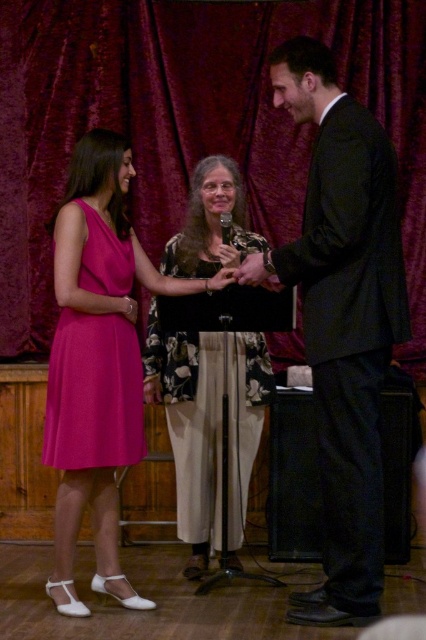
The width and height of the screenshot is (426, 640). What do you see at coordinates (207, 428) in the screenshot?
I see `floral-patterned blouse at center` at bounding box center [207, 428].

Measure the distance between floral-patterned blouse at center and camera.

The distance of floral-patterned blouse at center from camera is 3.06 meters.

The width and height of the screenshot is (426, 640). I want to click on floral-patterned blouse at center, so click(x=207, y=428).

From the picture: Between velvet dark red curtain at upper center and pink satin dress at left, which one appears on the left side from the viewer's perspective?

pink satin dress at left

Between point (178, 188) and point (68, 184), which one is positioned behind?

The point (178, 188) is more distant.

Identify the location of velvet dark red curtain at upper center. The image size is (426, 640). (189, 122).

Which is below, pink satin dress at left or black plastic microphone at center?

Positioned lower is pink satin dress at left.

Who is more forward, (85, 289) or (230, 218)?

Positioned in front is point (85, 289).

Who is more distant from viewer, (x=101, y=248) or (x=229, y=243)?

Positioned behind is point (x=229, y=243).

Find the location of a particular element. This screenshot has height=640, width=426. pink satin dress at left is located at coordinates (97, 362).